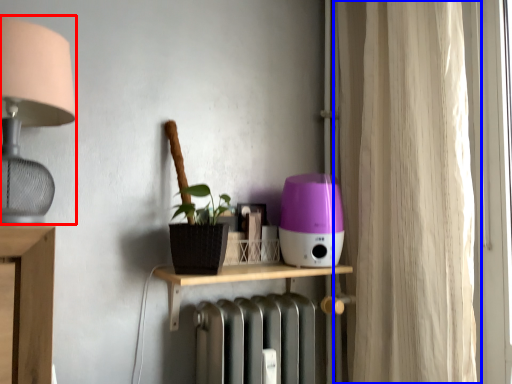
Question: Which object is further to the camera taking this photo, lamp (highlighted by a red box) or curtain (highlighted by a blue box)?

Choices:
 (A) lamp
 (B) curtain

Answer: (B)